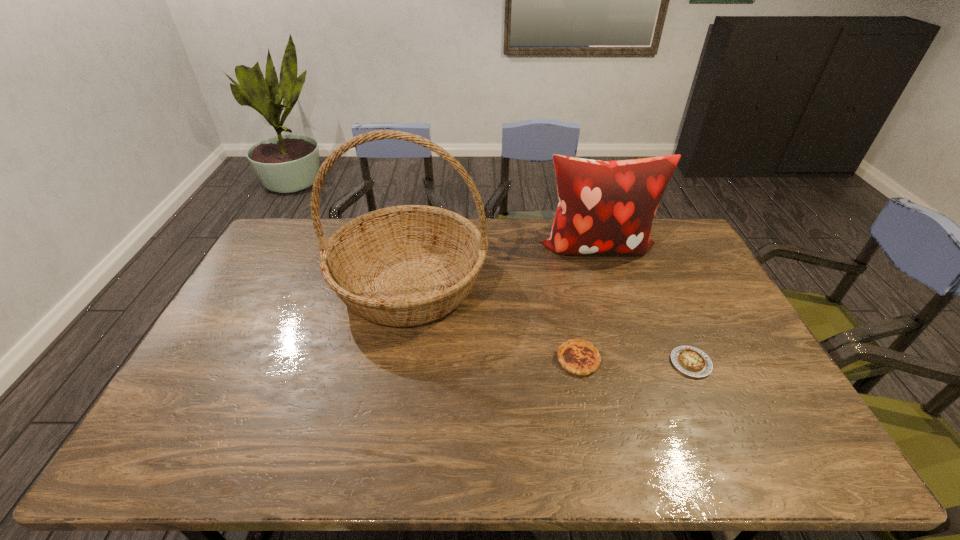
This screenshot has width=960, height=540. I want to click on vacant space located 0.190m on the left of the shortest object, so click(602, 363).

This screenshot has height=540, width=960. In order to click on basket present at the far edge in this screenshot , I will do `click(407, 265)`.

Locate an element on the screen. cushion that is at the far edge is located at coordinates (605, 207).

Locate an element on the screen. cushion that is at the right edge is located at coordinates (605, 207).

The width and height of the screenshot is (960, 540). What are the coordinates of `quiche that is at the right edge` in the screenshot? It's located at [x=691, y=361].

This screenshot has height=540, width=960. Find the location of `object at the far right corner`. object at the far right corner is located at coordinates (605, 207).

Locate an element on the screen. This screenshot has height=540, width=960. vacant space at the far edge of the desktop is located at coordinates (516, 228).

This screenshot has width=960, height=540. I want to click on vacant space at the near edge of the desktop, so click(497, 462).

Where is `free space at the right edge of the desktop`? The image size is (960, 540). free space at the right edge of the desktop is located at coordinates (759, 372).

This screenshot has height=540, width=960. In order to click on vacant area at the far left corner in this screenshot , I will do `click(282, 234)`.